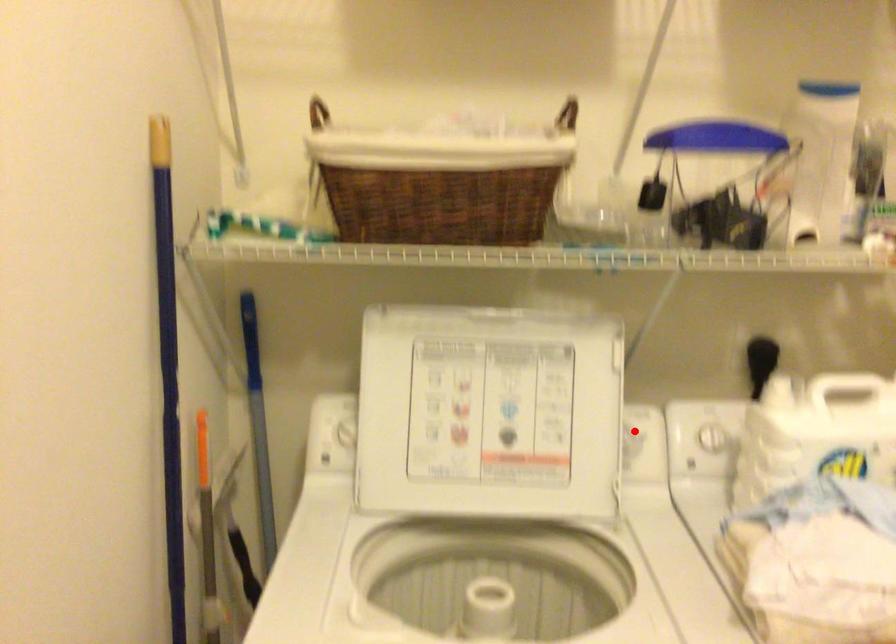
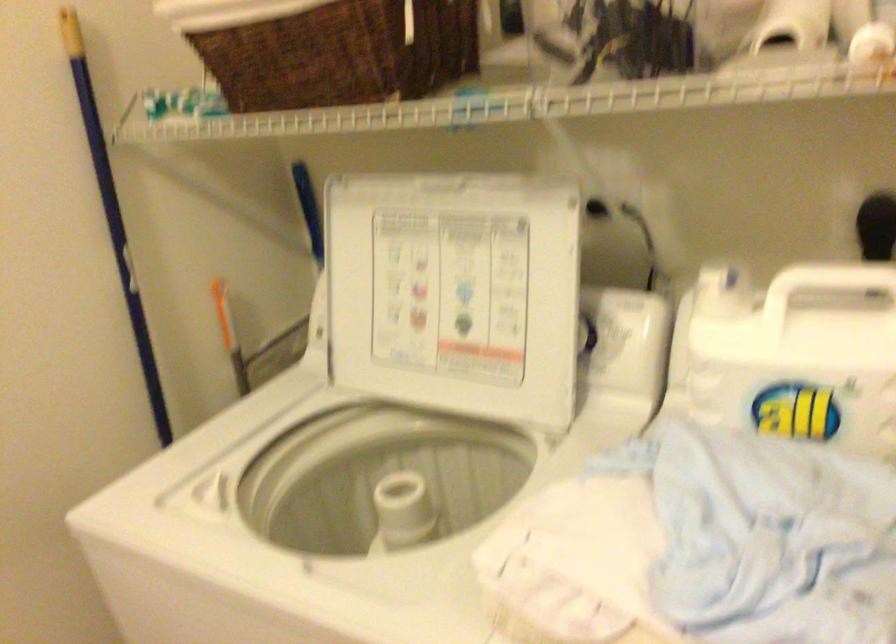
Locate, in the second image, the point that corresponds to the highlighted location in the first image.

(616, 325)